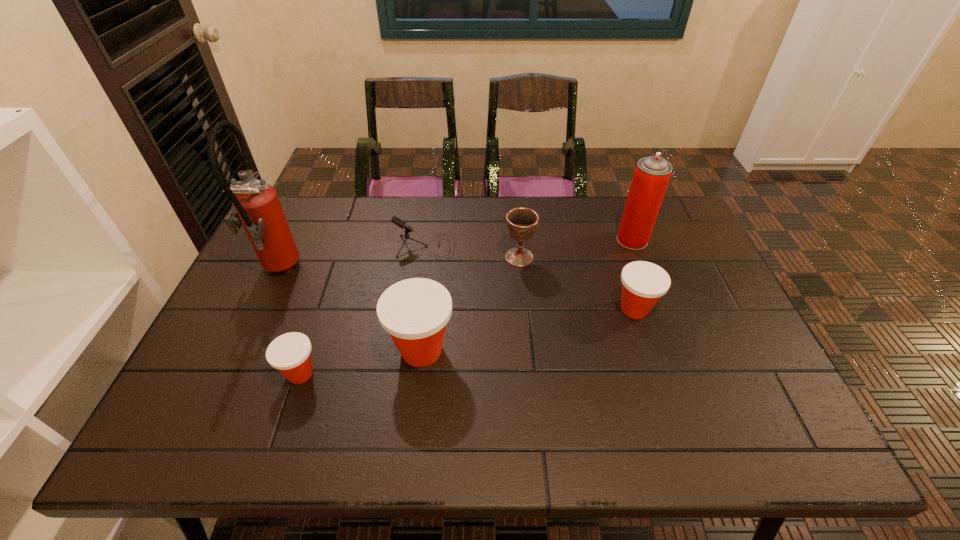
Image resolution: width=960 pixels, height=540 pixels. What are the coordinates of `free space that satisfies the following two spatial constraints: 1. at the nozzle of the fire extinguisher; 2. on the right side of the shortest Dixie cup` in the screenshot? It's located at (229, 374).

Where is `free location that satisfies the following two spatial constraints: 1. on the stand of the microphone; 2. on the front side of the leftmost Dixie cup`? This screenshot has height=540, width=960. free location that satisfies the following two spatial constraints: 1. on the stand of the microphone; 2. on the front side of the leftmost Dixie cup is located at coordinates (408, 374).